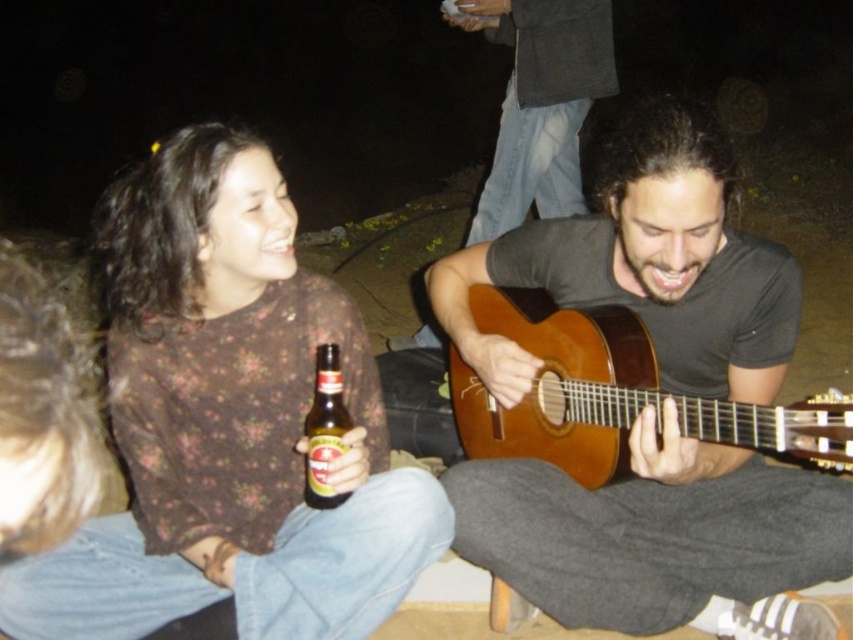
Which is below, wooden acoustic guitar at center or brown glass bottle at lower left?

brown glass bottle at lower left is lower down.

Is point (520, 333) farther from viewer compared to point (334, 368)?

That is True.

Locate an element on the screen. This screenshot has width=853, height=640. wooden acoustic guitar at center is located at coordinates (614, 396).

Measure the distance between point (780, 484) and camera.

They are 1.66 meters apart.

Is matte brown guitar at center closer to the viewer compared to dark gray sweater at upper center?

Yes.

Does point (440, 298) come behind point (459, 0)?

No.

You are a GUI agent. You are given a task and a screenshot of the screen. Output one action in this format:
    pyautogui.click(x=<x>, y=<y>)
    Task: Click on the matte brown guitar at center
    This screenshot has width=853, height=640.
    Given the screenshot: What is the action you would take?
    pyautogui.click(x=660, y=536)

Is brown floral shirt at upper left taller than brown glass bottle at lower left?

Yes.

Does point (129, 636) come farther from viewer compared to point (308, 499)?

Yes, point (129, 636) is behind point (308, 499).

Who is more distant from viewer, (314, 516) or (305, 476)?

The point (305, 476) is behind.

Locate an element on the screen. The width and height of the screenshot is (853, 640). brown floral shirt at upper left is located at coordinates (227, 424).